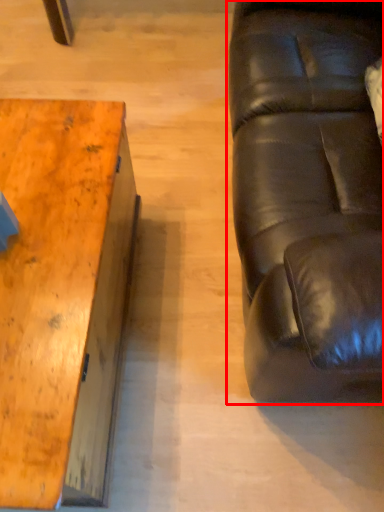
Question: Considering the relative positions of studio couch (annotated by the red box) and table in the image provided, where is studio couch (annotated by the red box) located with respect to the staircase?

Choices:
 (A) left
 (B) right

Answer: (B)